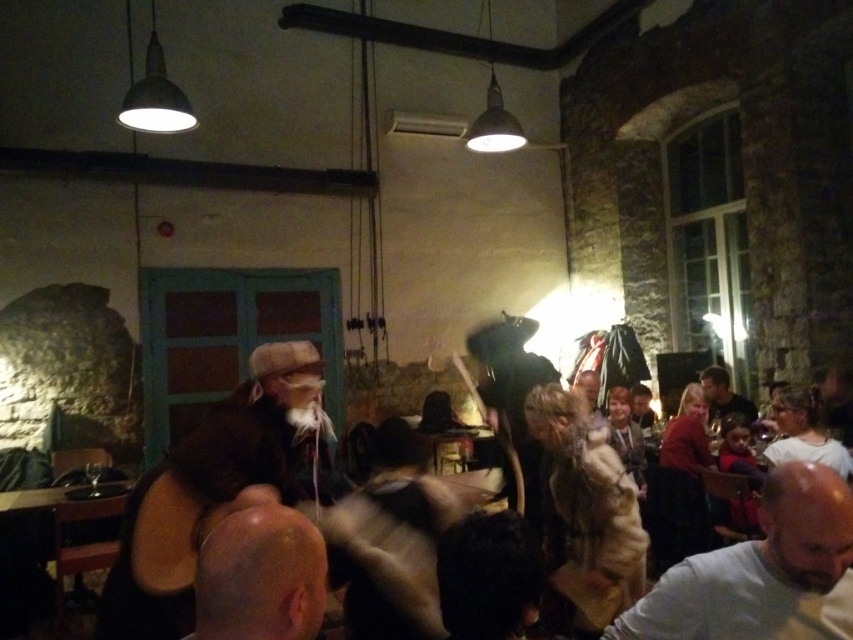
You are at a party and want to grab your jacket. You see the gray matte shirt at lower right and the smooth brown leather jacket at center. Which item is closer to the floor?

The gray matte shirt at lower right is located below the smooth brown leather jacket at center, so it is closer to the floor.